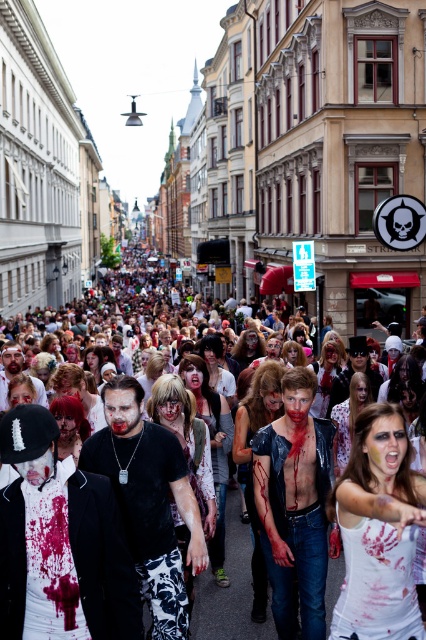
Question: Considering the real-world distances, which object is farthest from the blood-stained costumes at center?

Choices:
 (A) white matte suit at center
 (B) white matte tank top at lower right

Answer: (B)

Question: Among these objects, which one is farthest from the camera?

Choices:
 (A) blood-stained costumes at center
 (B) white matte suit at center

Answer: (A)

Question: Which of the following is the farthest from the observer?

Choices:
 (A) white matte suit at center
 (B) white matte tank top at lower right
 (C) blood-stained costumes at center

Answer: (C)

Question: Does blood-stained costumes at center have a smaller size compared to white matte tank top at lower right?

Choices:
 (A) yes
 (B) no

Answer: (B)

Question: Is white matte suit at center below white matte tank top at lower right?

Choices:
 (A) yes
 (B) no

Answer: (B)

Question: Can you confirm if blood-stained costumes at center is positioned above white matte tank top at lower right?

Choices:
 (A) yes
 (B) no

Answer: (A)